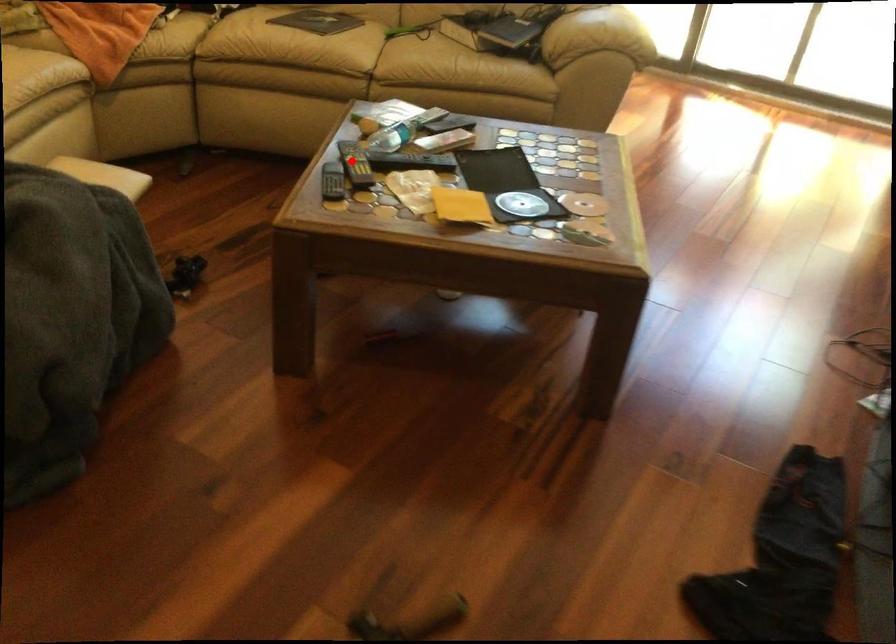
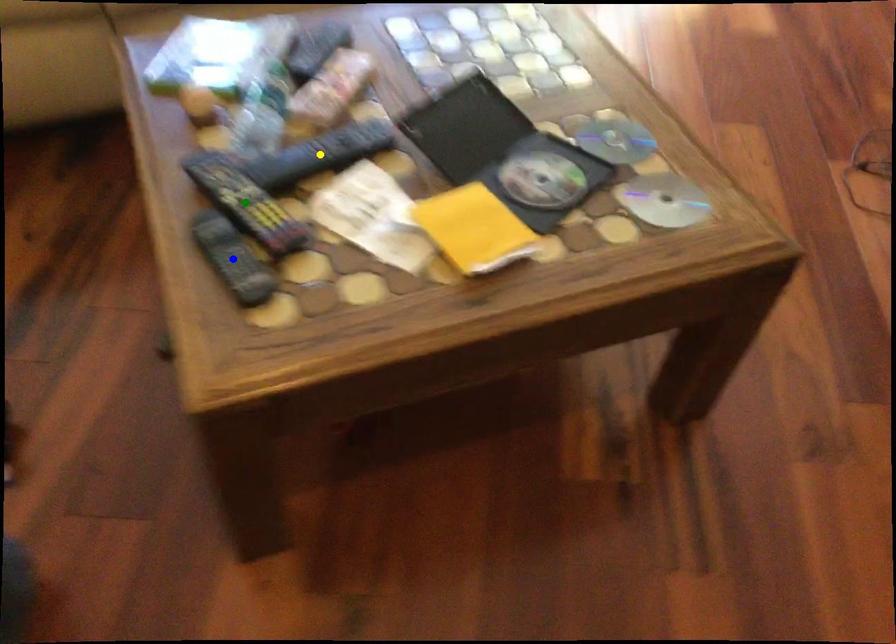
Question: I am providing you with two images of the same scene from different viewpoints. A red point is marked on the first image. You are given multiple points on the second image. Which spot in image 2 lines up with the point in image 1?

Choices:
 (A) yellow point
 (B) blue point
 (C) green point

Answer: (C)